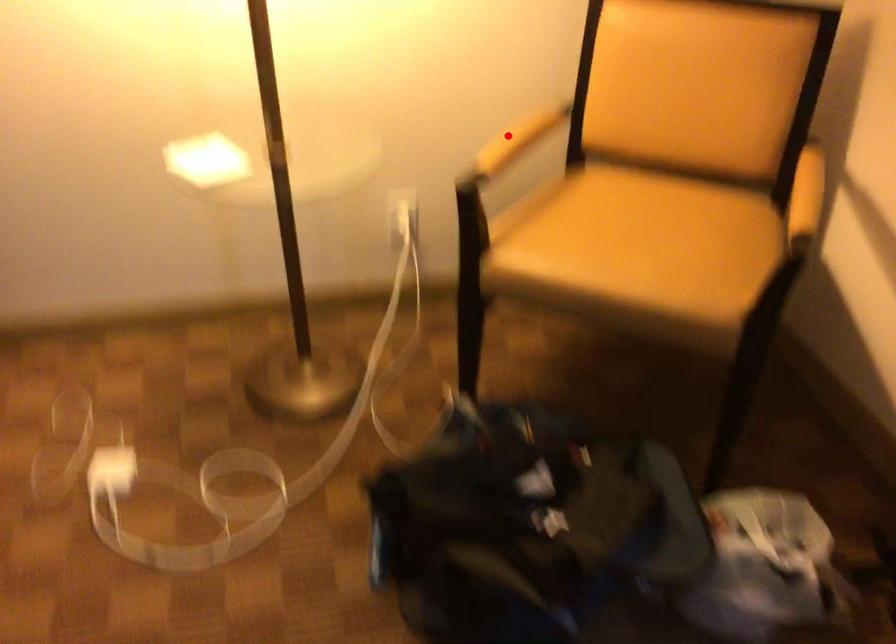
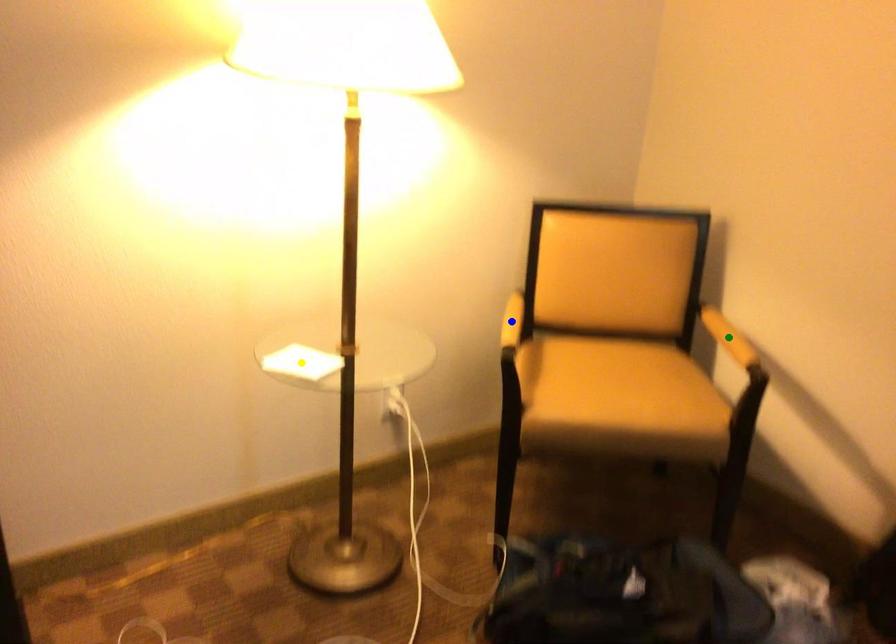
Question: I am providing you with two images of the same scene from different viewpoints. A red point is marked on the first image. You are given multiple points on the second image. Can you choose the point in image 2 that corresponds to the point in image 1?

Choices:
 (A) yellow point
 (B) blue point
 (C) green point

Answer: (B)